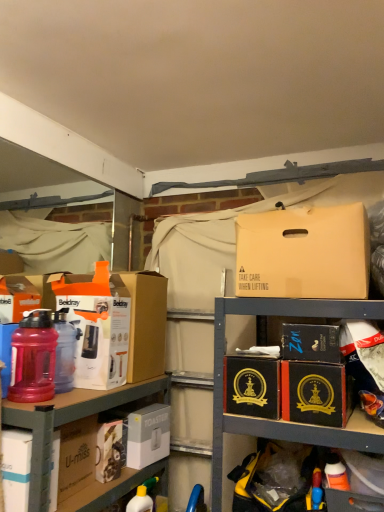
Question: Does yellow matte bottle at lower center turn towards black cardboard box at center-right, positioned as the first cardboard box in right-to-left order?

Choices:
 (A) yes
 (B) no

Answer: (B)

Question: From a real-world perspective, is yellow matte bottle at lower center positioned under black cardboard box at center-right, positioned as the first cardboard box in right-to-left order, based on gravity?

Choices:
 (A) no
 (B) yes

Answer: (B)

Question: Is yellow matte bottle at lower center turned away from black cardboard box at center-right, the 3th cardboard box from the left?

Choices:
 (A) yes
 (B) no

Answer: (B)

Question: Is yellow matte bottle at lower center behind black cardboard box at center-right, the 3th cardboard box from the left?

Choices:
 (A) no
 (B) yes

Answer: (B)

Question: Considering the relative sizes of yellow matte bottle at lower center and black cardboard box at center-right, positioned as the first cardboard box in right-to-left order, in the image provided, is yellow matte bottle at lower center taller than black cardboard box at center-right, positioned as the first cardboard box in right-to-left order,?

Choices:
 (A) yes
 (B) no

Answer: (A)

Question: From a real-world perspective, is matte plastic water bottle at left, which is the 6th box in right-to-left order, physically located above or below black cardboard box at center-right, positioned as the first box in right-to-left order?

Choices:
 (A) below
 (B) above

Answer: (A)

Question: In the image, is matte plastic water bottle at left, which ranks as the 1th box in left-to-right order, on the left side or the right side of black cardboard box at center-right, arranged as the 6th box when viewed from the left?

Choices:
 (A) right
 (B) left

Answer: (B)

Question: Do you think matte plastic water bottle at left, which is the 6th box in right-to-left order, is within black cardboard box at center-right, arranged as the 6th box when viewed from the left, or outside of it?

Choices:
 (A) outside
 (B) inside

Answer: (A)

Question: From the image's perspective, relative to black cardboard box at center-right, arranged as the 6th box when viewed from the left, is matte plastic water bottle at left, which ranks as the 1th box in left-to-right order, above or below?

Choices:
 (A) above
 (B) below

Answer: (B)

Question: From the image's perspective, is black cardboard box at center-right, the 3th cardboard box from the left, positioned above or below matte plastic water bottle at left, the 2th bottle when ordered from front to back?

Choices:
 (A) below
 (B) above

Answer: (A)

Question: In terms of width, does black cardboard box at center-right, positioned as the first cardboard box in right-to-left order, look wider or thinner when compared to matte plastic water bottle at left, the first bottle viewed from the back?

Choices:
 (A) wide
 (B) thin

Answer: (A)

Question: Is black cardboard box at center-right, positioned as the first cardboard box in right-to-left order, spatially inside matte plastic water bottle at left, the first bottle viewed from the back, or outside of it?

Choices:
 (A) outside
 (B) inside

Answer: (A)

Question: Is black cardboard box at center-right, the 3th cardboard box from the left, bigger or smaller than matte plastic water bottle at left, the 2th bottle when ordered from front to back?

Choices:
 (A) small
 (B) big

Answer: (B)

Question: Is white cardboard toaster at lower left spatially inside black cardboard box at center, the second cardboard box in the right-to-left sequence, or outside of it?

Choices:
 (A) outside
 (B) inside

Answer: (A)

Question: From a real-world perspective, is white cardboard toaster at lower left above or below black cardboard box at center, which is the 2th cardboard box from left to right?

Choices:
 (A) above
 (B) below

Answer: (B)